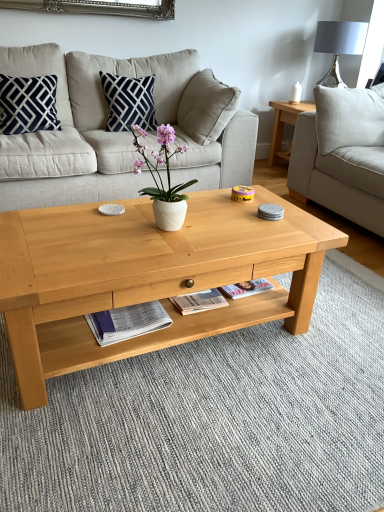
Question: Considering the relative sizes of navy blue fabric pillow at upper center, which ranks as the 2th pillow in left-to-right order, and white glossy magazine at lower center in the image provided, is navy blue fabric pillow at upper center, which ranks as the 2th pillow in left-to-right order, bigger than white glossy magazine at lower center?

Choices:
 (A) yes
 (B) no

Answer: (A)

Question: From a real-world perspective, is navy blue fabric pillow at upper center, which ranks as the 2th pillow in left-to-right order, physically above white glossy magazine at lower center?

Choices:
 (A) yes
 (B) no

Answer: (A)

Question: Can we say navy blue fabric pillow at upper center, which ranks as the 2th pillow in left-to-right order, lies outside white glossy magazine at lower center?

Choices:
 (A) yes
 (B) no

Answer: (A)

Question: Is the surface of navy blue fabric pillow at upper center, which is counted as the 1th pillow, starting from the right, in direct contact with white glossy magazine at lower center?

Choices:
 (A) yes
 (B) no

Answer: (B)

Question: From the image's perspective, does navy blue fabric pillow at upper center, which is counted as the 1th pillow, starting from the right, appear lower than white glossy magazine at lower center?

Choices:
 (A) no
 (B) yes

Answer: (A)

Question: Would you say navy blue fabric pillow at upper center, which is counted as the 1th pillow, starting from the right, is to the left or to the right of white matte vase at center in the picture?

Choices:
 (A) left
 (B) right

Answer: (A)

Question: Considering the positions of navy blue fabric pillow at upper center, which ranks as the 2th pillow in left-to-right order, and white matte vase at center in the image, is navy blue fabric pillow at upper center, which ranks as the 2th pillow in left-to-right order, bigger or smaller than white matte vase at center?

Choices:
 (A) big
 (B) small

Answer: (A)

Question: Looking at their shapes, would you say navy blue fabric pillow at upper center, which ranks as the 2th pillow in left-to-right order, is wider or thinner than white matte vase at center?

Choices:
 (A) thin
 (B) wide

Answer: (B)

Question: Do you think navy blue fabric pillow at upper center, which ranks as the 2th pillow in left-to-right order, is within white matte vase at center, or outside of it?

Choices:
 (A) inside
 (B) outside

Answer: (B)

Question: Looking at their shapes, would you say natural wood coffee table at center is wider or thinner than beige fabric couch at center, the first studio couch from the left?

Choices:
 (A) wide
 (B) thin

Answer: (B)

Question: Is natural wood coffee table at center inside or outside of beige fabric couch at center, placed as the 2th studio couch when sorted from right to left?

Choices:
 (A) inside
 (B) outside

Answer: (B)

Question: From their relative heights in the image, would you say natural wood coffee table at center is taller or shorter than beige fabric couch at center, placed as the 2th studio couch when sorted from right to left?

Choices:
 (A) short
 (B) tall

Answer: (A)

Question: From a real-world perspective, is natural wood coffee table at center above or below beige fabric couch at center, placed as the 2th studio couch when sorted from right to left?

Choices:
 (A) below
 (B) above

Answer: (A)

Question: In the image, is navy blue velvet pillow at upper left, marked as the second pillow in a right-to-left arrangement, on the left side or the right side of light gray fabric couch at right, which is the second studio couch from left to right?

Choices:
 (A) left
 (B) right

Answer: (A)

Question: Which is correct: navy blue velvet pillow at upper left, which is counted as the 1th pillow, starting from the left, is inside light gray fabric couch at right, the 1th studio couch from the right, or outside of it?

Choices:
 (A) inside
 (B) outside

Answer: (B)